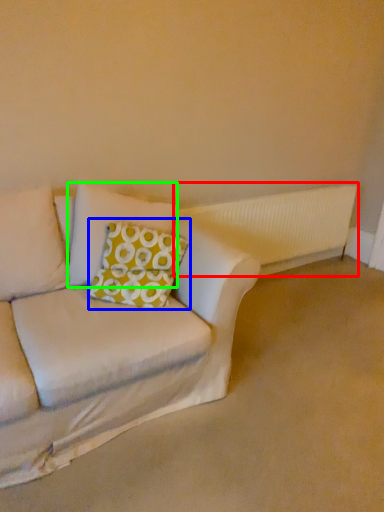
Question: Based on their relative distances, which object is nearer to radiator (highlighted by a red box)? Choose from throw pillow (highlighted by a blue box) and pillow (highlighted by a green box).

Choices:
 (A) throw pillow
 (B) pillow

Answer: (B)